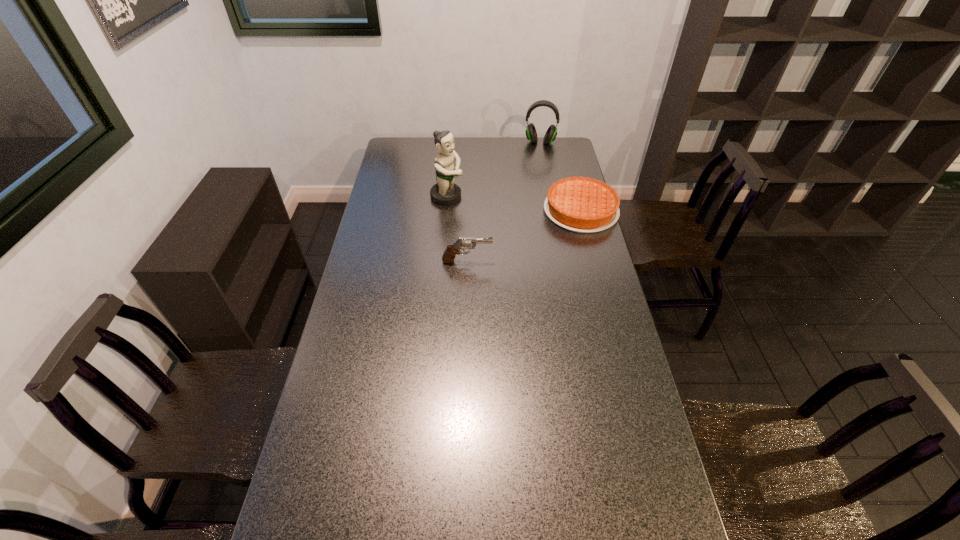
Where is `free space located 0.140m on the front-facing side of the tallest object`? The image size is (960, 540). free space located 0.140m on the front-facing side of the tallest object is located at coordinates (488, 213).

In order to click on free space located on the ear cups of the farthest object in this screenshot , I will do `click(536, 188)`.

Image resolution: width=960 pixels, height=540 pixels. Find the location of `vacant space located 0.260m on the ear cups of the farthest object`. vacant space located 0.260m on the ear cups of the farthest object is located at coordinates (537, 176).

Where is `blank area located 0.210m on the ear cups of the farthest object`? The image size is (960, 540). blank area located 0.210m on the ear cups of the farthest object is located at coordinates (537, 170).

At what (x,y) coordinates should I click in order to perform the action: click on object at the far edge. Please return your answer as a coordinate pair (x, y). This screenshot has width=960, height=540. Looking at the image, I should click on (531, 134).

Find the location of `pie located at the right edge`. pie located at the right edge is located at coordinates (580, 204).

Locate an element on the screen. headset that is at the right edge is located at coordinates (531, 134).

Where is `object that is at the far right corner`? object that is at the far right corner is located at coordinates (531, 134).

Where is `blank space at the far edge`? This screenshot has width=960, height=540. blank space at the far edge is located at coordinates (469, 160).

Find the location of a particular element. Image resolution: width=960 pixels, height=540 pixels. free location at the near edge is located at coordinates tap(480, 516).